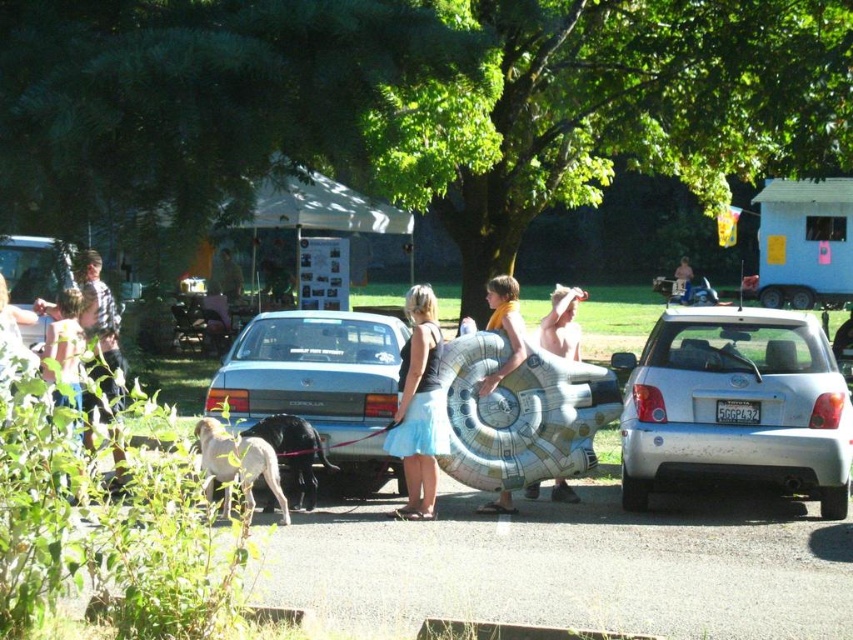
Which is in front, point (297, 440) or point (769, 291)?

Point (297, 440) is in front.

Is black fur dog at center bigger than black rubber tire at rear right?

Incorrect, black fur dog at center is not larger than black rubber tire at rear right.

Identify the location of black fur dog at center. The height and width of the screenshot is (640, 853). (294, 452).

The height and width of the screenshot is (640, 853). I want to click on black fur dog at center, so click(294, 452).

Between black satin skirt at center and black rubber tire at rear right, which one appears on the right side from the viewer's perspective?

black rubber tire at rear right

Is point (422, 362) positioned in front of point (764, 296)?

Yes, it is.

Which is in front, point (426, 476) or point (775, 305)?

Point (426, 476) is more forward.

Image resolution: width=853 pixels, height=640 pixels. I want to click on black satin skirt at center, so click(x=419, y=406).

Is black satin skirt at center to the right of black fur dog at center from the viewer's perspective?

Correct, you'll find black satin skirt at center to the right of black fur dog at center.

Consider the image. Does black satin skirt at center have a greater height compared to black fur dog at center?

Indeed, black satin skirt at center has a greater height compared to black fur dog at center.

What do you see at coordinates (419, 406) in the screenshot? The width and height of the screenshot is (853, 640). I see `black satin skirt at center` at bounding box center [419, 406].

Where is `black satin skirt at center`? This screenshot has height=640, width=853. black satin skirt at center is located at coordinates (419, 406).